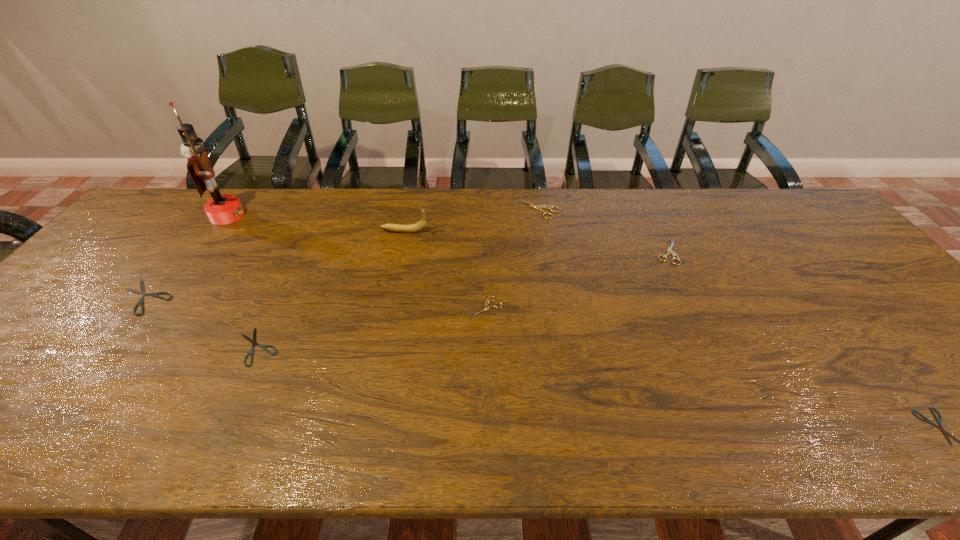
Where is `nutcracker`? nutcracker is located at coordinates (221, 209).

The height and width of the screenshot is (540, 960). In order to click on the tallest object in this screenshot , I will do `click(221, 209)`.

Find the location of a particular element. the fifth object from right to left is located at coordinates (420, 225).

You are a GUI agent. You are given a task and a screenshot of the screen. Output one action in this format:
    pyautogui.click(x=<x>, y=<y>)
    Task: Click on the yellow banana
    The image size is (960, 540).
    Given the screenshot: What is the action you would take?
    pyautogui.click(x=420, y=225)

Locate an element on the screen. the tallest shears is located at coordinates (538, 207).

Where is `the second beige shears from left to right`? Image resolution: width=960 pixels, height=540 pixels. the second beige shears from left to right is located at coordinates (538, 207).

Where is `the second shears from right to left`? Image resolution: width=960 pixels, height=540 pixels. the second shears from right to left is located at coordinates (669, 251).

Find the location of `the second tallest shears`. the second tallest shears is located at coordinates (669, 251).

This screenshot has width=960, height=540. Find the location of `the leftmost black shears`. the leftmost black shears is located at coordinates (141, 292).

You are a GUI agent. You are given a task and a screenshot of the screen. Output one action in this format:
    pyautogui.click(x=<x>, y=<y>)
    Task: Click on the biggest black shears
    Image resolution: width=960 pixels, height=540 pixels.
    Given the screenshot: What is the action you would take?
    pos(141,292)